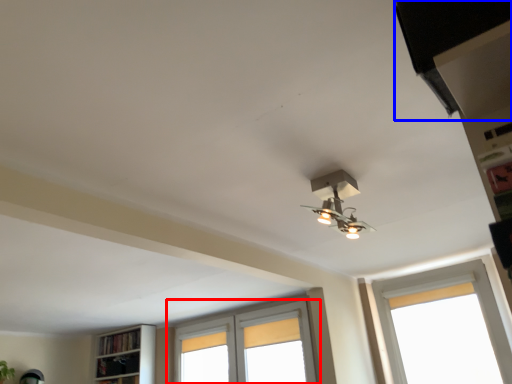
Question: Among these objects, which one is nearest to the camera, window (highlighted by a red box) or exhaust hood (highlighted by a blue box)?

Choices:
 (A) window
 (B) exhaust hood

Answer: (B)